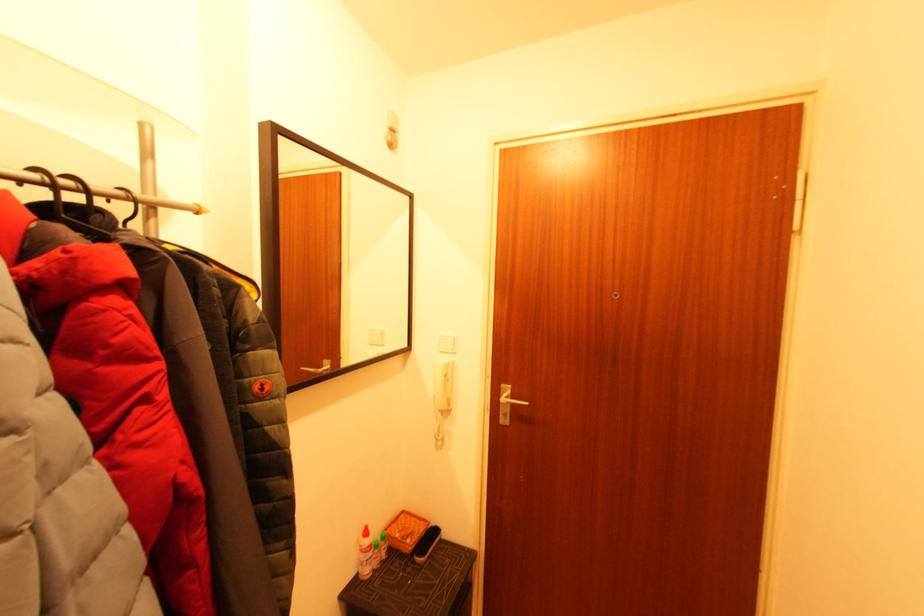
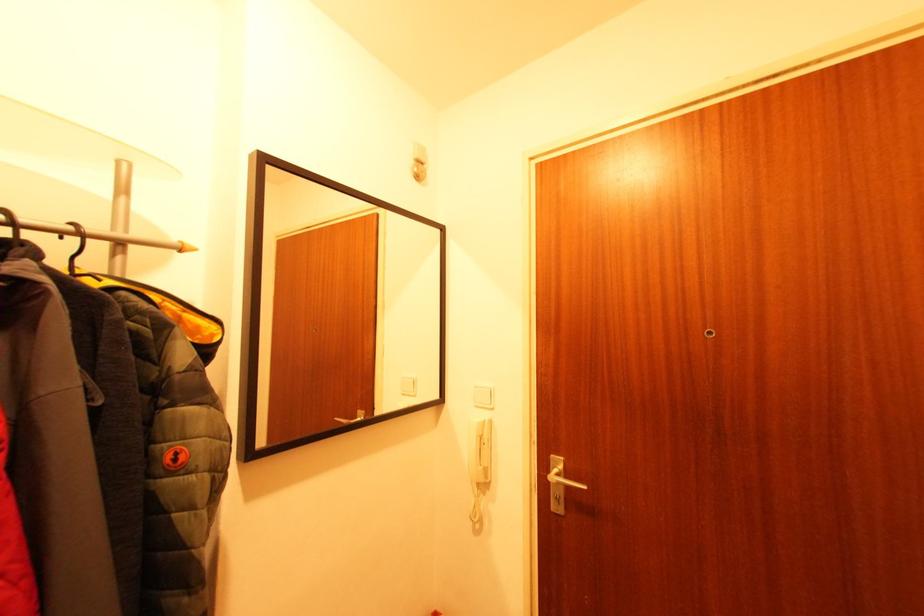
Question: Based on the continuous images, in which direction is the camera rotating? Reply with the corresponding letter.

Choices:
 (A) Left
 (B) Right
 (C) Up
 (D) Down

Answer: (A)